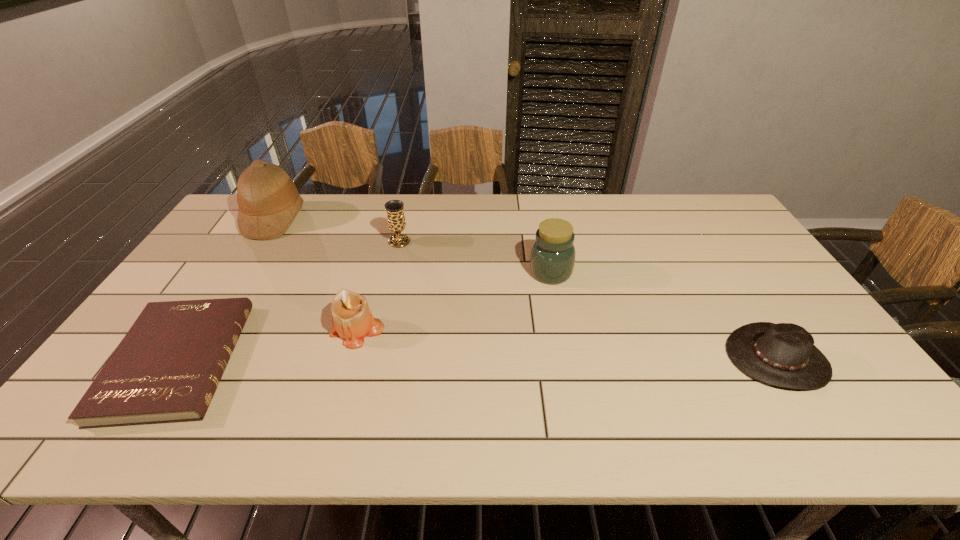
Locate an element on the screen. Image resolution: width=960 pixels, height=540 pixels. the left hat is located at coordinates (268, 200).

Find the location of a particular element. This screenshot has height=540, width=960. the farther hat is located at coordinates (268, 200).

The width and height of the screenshot is (960, 540). What are the coordinates of `the fifth object from left to right` in the screenshot? It's located at (552, 259).

Identify the location of jar. The width and height of the screenshot is (960, 540). (552, 259).

At what (x,y) coordinates should I click in order to perform the action: click on chalice. Please return your answer as a coordinate pair (x, y). The height and width of the screenshot is (540, 960). Looking at the image, I should click on (396, 222).

I want to click on candle, so click(x=351, y=316).

I want to click on the rightmost object, so (784, 355).

This screenshot has height=540, width=960. Identify the location of the shorter hat. (784, 355).

Image resolution: width=960 pixels, height=540 pixels. What are the coordinates of `the shortest object` in the screenshot? It's located at (166, 369).

Where is `vacant region located on the front-facing side of the left hat`? vacant region located on the front-facing side of the left hat is located at coordinates (326, 219).